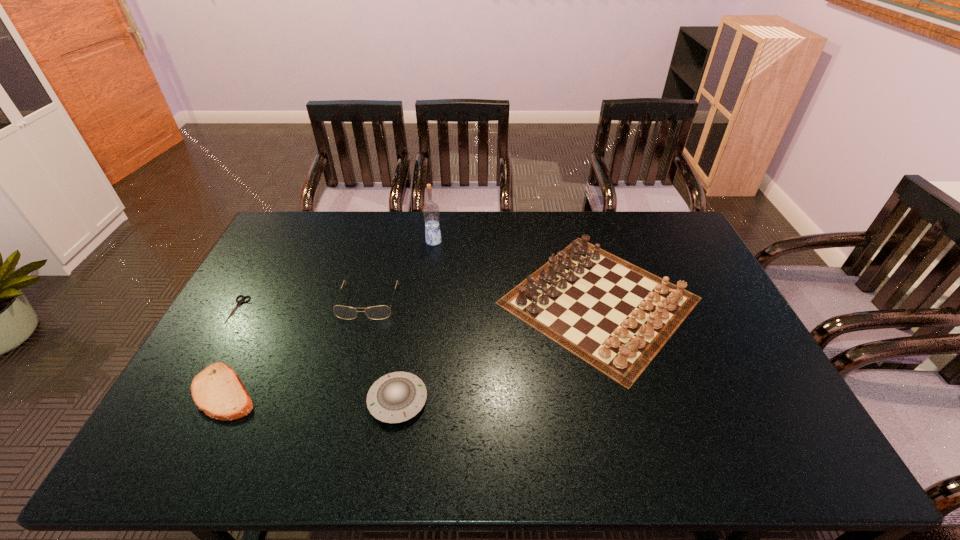
Image resolution: width=960 pixels, height=540 pixels. In order to click on empty location between the saucer and the fourth shortest object in this screenshot , I will do `click(383, 351)`.

Identify the location of blank region between the shortest object and the tallest object. (336, 275).

Identify the location of free space between the shortest object and the tallest object. (336, 275).

At what (x,y) coordinates should I click in order to perform the action: click on unoccupied area between the chessboard and the saucer. Please return your answer as a coordinate pair (x, y). This screenshot has height=540, width=960. Looking at the image, I should click on (498, 350).

I want to click on object that is the second closest to the pita bread, so click(380, 312).

Select which object is the closest to the shears. Please provide its 2D coordinates. Your answer should be formatted as a tuple, i.e. [(x, y)], where the tuple contains the x and y coordinates of a point satisfying the conditions above.

[(217, 390)]